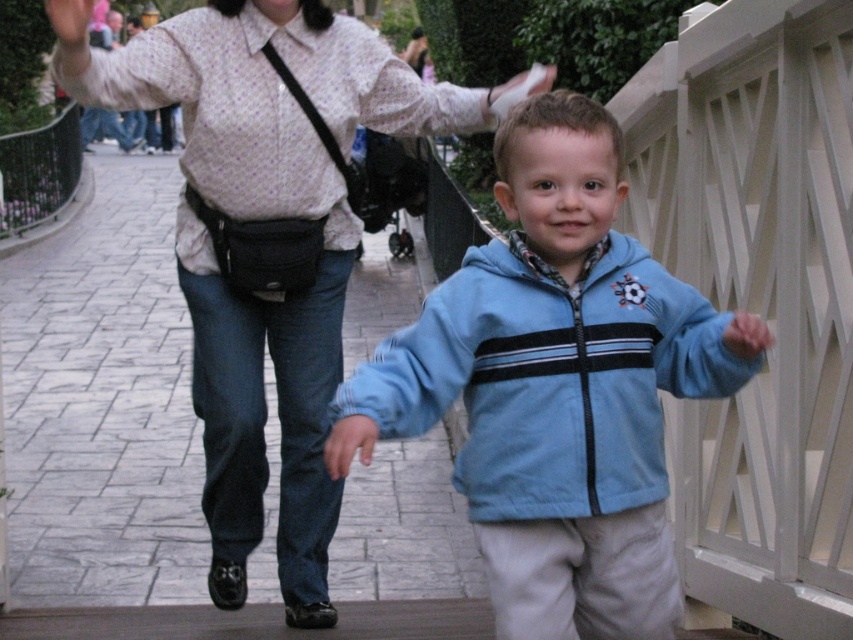
What is located at the point with coordinates (556, 387)?

The point with coordinates (556, 387) marks the location of the light blue fleece jacket at center.

You are a photographer trying to capture a photo of both the light blue fleece jacket at center and the matte white blouse at center. Since you want to ensure both are fully visible in the frame, which object should you focus on to avoid cropping the bottom of the taller one?

The matte white blouse at center is taller than the light blue fleece jacket at center. To avoid cropping the bottom of the taller one, you should focus on the matte white blouse at center and adjust the frame accordingly.